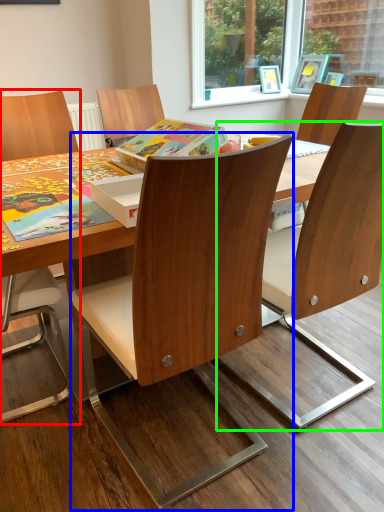
Question: Which object is positioned closest to chair (highlighted by a red box)? Select from chair (highlighted by a blue box) and chair (highlighted by a green box).

Choices:
 (A) chair
 (B) chair

Answer: (A)